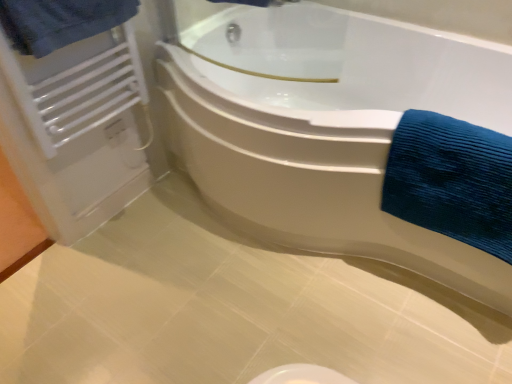
Question: Considering the relative sizes of blue textured towel at right, which ranks as the first bath towel in bottom-to-top order, and white glossy bathtub at center in the image provided, is blue textured towel at right, which ranks as the first bath towel in bottom-to-top order, taller than white glossy bathtub at center?

Choices:
 (A) no
 (B) yes

Answer: (A)

Question: Is blue textured towel at right, which ranks as the first bath towel in bottom-to-top order, outside of white glossy bathtub at center?

Choices:
 (A) no
 (B) yes

Answer: (A)

Question: Is blue textured towel at right, the 1th bath towel from the right, next to white glossy bathtub at center and touching it?

Choices:
 (A) no
 (B) yes

Answer: (A)

Question: Considering the relative sizes of blue textured towel at right, which ranks as the first bath towel in bottom-to-top order, and white glossy bathtub at center in the image provided, is blue textured towel at right, which ranks as the first bath towel in bottom-to-top order, thinner than white glossy bathtub at center?

Choices:
 (A) yes
 (B) no

Answer: (A)

Question: From a real-world perspective, is blue textured towel at right, the 1th bath towel from the right, beneath white glossy bathtub at center?

Choices:
 (A) no
 (B) yes

Answer: (A)

Question: Considering the positions of blue textured towel at upper left, the 2th bath towel positioned from the right, and white metallic radiator at upper left in the image, is blue textured towel at upper left, the 2th bath towel positioned from the right, wider or thinner than white metallic radiator at upper left?

Choices:
 (A) thin
 (B) wide

Answer: (B)

Question: Considering their positions, is blue textured towel at upper left, which appears as the 1th bath towel when viewed from the top, located in front of or behind white metallic radiator at upper left?

Choices:
 (A) front
 (B) behind

Answer: (A)

Question: Visually, is blue textured towel at upper left, which ranks as the second bath towel in bottom-to-top order, positioned to the left or to the right of white metallic radiator at upper left?

Choices:
 (A) left
 (B) right

Answer: (B)

Question: Is point (120, 1) positioned closer to the camera than point (52, 82)?

Choices:
 (A) farther
 (B) closer

Answer: (B)

Question: Considering the positions of blue textured towel at upper left, which ranks as the second bath towel in bottom-to-top order, and white glossy bathtub at center in the image, is blue textured towel at upper left, which ranks as the second bath towel in bottom-to-top order, wider or thinner than white glossy bathtub at center?

Choices:
 (A) wide
 (B) thin

Answer: (B)

Question: Does point (41, 11) appear closer or farther from the camera than point (388, 135)?

Choices:
 (A) closer
 (B) farther

Answer: (A)

Question: Visually, is blue textured towel at upper left, the 1th bath towel in the left-to-right sequence, positioned to the left or to the right of white glossy bathtub at center?

Choices:
 (A) right
 (B) left

Answer: (B)

Question: From their relative heights in the image, would you say blue textured towel at upper left, the 1th bath towel in the left-to-right sequence, is taller or shorter than white glossy bathtub at center?

Choices:
 (A) tall
 (B) short

Answer: (B)

Question: Is white metallic radiator at upper left bigger or smaller than blue textured towel at right, the 1th bath towel from the right?

Choices:
 (A) big
 (B) small

Answer: (B)

Question: From the image's perspective, is white metallic radiator at upper left positioned above or below blue textured towel at right, placed as the second bath towel when sorted from top to bottom?

Choices:
 (A) above
 (B) below

Answer: (A)